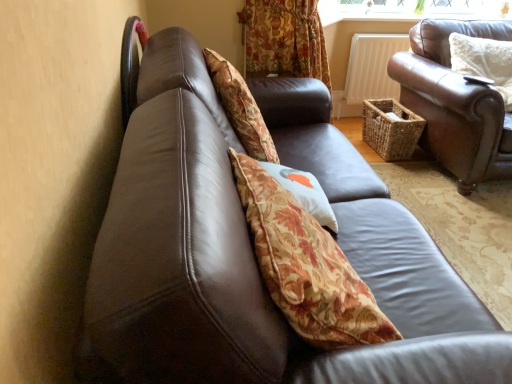
Where is `white fluffy pillow at upper right, which is the 2th pillow from bottom to top`? This screenshot has height=384, width=512. white fluffy pillow at upper right, which is the 2th pillow from bottom to top is located at coordinates (484, 62).

The image size is (512, 384). Find the location of `shiny black chair at upper left`. shiny black chair at upper left is located at coordinates (130, 66).

You are a GUI agent. You are given a task and a screenshot of the screen. Output one action in this format:
    pyautogui.click(x=<x>, y=<y>)
    Task: Click on the floral fabric cushion at center, the 2th pillow when ordered from right to left
    
    Given the screenshot: What is the action you would take?
    298,189

Which of these two, shiny black chair at upper left or brown leather couch at right, is smaller?

shiny black chair at upper left.

Consider the image. Is shiny black chair at upper left beside brown leather couch at right?

shiny black chair at upper left is not next to brown leather couch at right, and they're not touching.

From a real-world perspective, relative to brown leather couch at right, is shiny black chair at upper left vertically above or below?

shiny black chair at upper left is situated higher than brown leather couch at right in the real world.

Does white fluffy pillow at upper right, which is the second pillow from left to right, come in front of brown leather couch at right?

No, white fluffy pillow at upper right, which is the second pillow from left to right, is behind brown leather couch at right.

In the scene shown: From the image's perspective, is white fluffy pillow at upper right, which is the first pillow from right to left, over brown leather couch at right?

Yes, from the image's perspective, white fluffy pillow at upper right, which is the first pillow from right to left, is over brown leather couch at right.

Which is more to the left, white fluffy pillow at upper right, the 1th pillow viewed from the top, or brown leather couch at right?

white fluffy pillow at upper right, the 1th pillow viewed from the top, is more to the left.

Is white fluffy pillow at upper right, the 1th pillow viewed from the top, positioned far away from brown leather couch at right?

They are positioned close to each other.

From the image's perspective, which is below, brown leather couch at right or floral fabric cushion at center, the 1th pillow ordered from the bottom?

floral fabric cushion at center, the 1th pillow ordered from the bottom, appears lower in the image.

From a real-world perspective, which object rests below the other?

brown leather couch at right, from a real-world perspective.

Which of these two, brown leather couch at right or floral fabric cushion at center, the 2th pillow when ordered from right to left, is bigger?

brown leather couch at right is bigger.

Are brown leather couch at right and shiny black chair at upper left located far from each other?

Absolutely, brown leather couch at right is distant from shiny black chair at upper left.

Does brown leather couch at right have a greater width compared to shiny black chair at upper left?

Correct, the width of brown leather couch at right exceeds that of shiny black chair at upper left.

Which object is more forward, brown leather couch at right or shiny black chair at upper left?

shiny black chair at upper left is closer to the camera.

The width and height of the screenshot is (512, 384). In the image, there is a shiny black chair at upper left. In order to click on studio couch below it (from the image's perspective) in this screenshot , I will do `click(455, 103)`.

How different are the orientations of floral fabric cushion at center, which is the 2th pillow in top-to-bottom order, and white fluffy pillow at upper right, placed as the 2th pillow when sorted from front to back, in degrees?

They differ by 94.4 degrees in their facing directions.

Can you confirm if floral fabric cushion at center, the 2th pillow when ordered from right to left, is thinner than white fluffy pillow at upper right, which is the first pillow from right to left?

Yes.

Is floral fabric cushion at center, the 1th pillow ordered from the bottom, facing away from white fluffy pillow at upper right, placed as the 2th pillow when sorted from front to back?

Answer: floral fabric cushion at center, the 1th pillow ordered from the bottom, is not turned away from white fluffy pillow at upper right, placed as the 2th pillow when sorted from front to back.

Would you say floral fabric cushion at center, which appears as the second pillow when viewed from the back, contains white fluffy pillow at upper right, placed as the 2th pillow when sorted from front to back?

No, white fluffy pillow at upper right, placed as the 2th pillow when sorted from front to back, is not inside floral fabric cushion at center, which appears as the second pillow when viewed from the back.

From the image's perspective, is white fluffy pillow at upper right, which is the 2th pillow from bottom to top, located above shiny black chair at upper left?

Yes, from the image's perspective, white fluffy pillow at upper right, which is the 2th pillow from bottom to top, is over shiny black chair at upper left.

Is white fluffy pillow at upper right, the 1th pillow viewed from the top, next to shiny black chair at upper left and touching it?

No, white fluffy pillow at upper right, the 1th pillow viewed from the top, is not beside shiny black chair at upper left.

From a real-world perspective, which is physically below, white fluffy pillow at upper right, positioned as the 1th pillow in back-to-front order, or shiny black chair at upper left?

white fluffy pillow at upper right, positioned as the 1th pillow in back-to-front order, from a real-world perspective.

Can you tell me how much white fluffy pillow at upper right, placed as the 2th pillow when sorted from front to back, and shiny black chair at upper left differ in facing direction?

93.5 degrees separate the facing orientations of white fluffy pillow at upper right, placed as the 2th pillow when sorted from front to back, and shiny black chair at upper left.

Looking at this image, based on their positions, is shiny black chair at upper left located to the left or right of white fluffy pillow at upper right, which is the first pillow from right to left?

shiny black chair at upper left is positioned on white fluffy pillow at upper right, which is the first pillow from right to left,'s left side.

Would you say shiny black chair at upper left is a long distance from white fluffy pillow at upper right, which is the 2th pillow from bottom to top?

That's right, there is a large distance between shiny black chair at upper left and white fluffy pillow at upper right, which is the 2th pillow from bottom to top.

Could you tell me if shiny black chair at upper left is facing white fluffy pillow at upper right, placed as the 2th pillow when sorted from front to back?

Yes, shiny black chair at upper left faces towards white fluffy pillow at upper right, placed as the 2th pillow when sorted from front to back.

The height and width of the screenshot is (384, 512). In order to click on chair located on the left of brown leather couch at right in this screenshot , I will do `click(130, 66)`.

You are a GUI agent. You are given a task and a screenshot of the screen. Output one action in this format:
    pyautogui.click(x=<x>, y=<y>)
    Task: Click on the studio couch in front of the white fluffy pillow at upper right, which is the 2th pillow from bottom to top
    The image size is (512, 384).
    Given the screenshot: What is the action you would take?
    pyautogui.click(x=455, y=103)

Based on their spatial positions, is shiny black chair at upper left or brown leather couch at right further from floral fabric cushion at center, the 2th pillow when ordered from right to left?

brown leather couch at right lies further to floral fabric cushion at center, the 2th pillow when ordered from right to left, than the other object.

Estimate the real-world distances between objects in this image. Which object is closer to brown leather couch at right, white fluffy pillow at upper right, placed as the 2th pillow when sorted from front to back, or shiny black chair at upper left?

Based on the image, white fluffy pillow at upper right, placed as the 2th pillow when sorted from front to back, appears to be nearer to brown leather couch at right.

Which object lies nearer to the anchor point floral fabric cushion at center, which is the 2th pillow in top-to-bottom order, brown leather couch at right or shiny black chair at upper left?

shiny black chair at upper left lies closer to floral fabric cushion at center, which is the 2th pillow in top-to-bottom order, than the other object.

From the image, which object appears to be farther from shiny black chair at upper left, floral fabric cushion at center, which appears as the second pillow when viewed from the back, or white fluffy pillow at upper right, which is the first pillow from right to left?

The object further to shiny black chair at upper left is white fluffy pillow at upper right, which is the first pillow from right to left.

Which object lies nearer to the anchor point brown leather couch at right, shiny black chair at upper left or floral fabric cushion at center, which appears as the second pillow when viewed from the back?

Among the two, floral fabric cushion at center, which appears as the second pillow when viewed from the back, is located nearer to brown leather couch at right.

Which object lies further to the anchor point white fluffy pillow at upper right, the 1th pillow viewed from the top, floral fabric cushion at center, which appears as the second pillow when viewed from the back, or brown leather couch at right?

Based on the image, floral fabric cushion at center, which appears as the second pillow when viewed from the back, appears to be further to white fluffy pillow at upper right, the 1th pillow viewed from the top.

Estimate the real-world distances between objects in this image. Which object is further from white fluffy pillow at upper right, which is the 2th pillow from bottom to top, brown leather couch at right or shiny black chair at upper left?

shiny black chair at upper left.

From the image, which object appears to be farther from shiny black chair at upper left, brown leather couch at right or floral fabric cushion at center, which appears as the second pillow when viewed from the back?

The object further to shiny black chair at upper left is brown leather couch at right.

Where is `pillow between floral fabric cushion at center, which is the 2th pillow in top-to-bottom order, and brown leather couch at right from left to right`? The image size is (512, 384). pillow between floral fabric cushion at center, which is the 2th pillow in top-to-bottom order, and brown leather couch at right from left to right is located at coordinates (484, 62).

Image resolution: width=512 pixels, height=384 pixels. I want to click on pillow located between shiny black chair at upper left and white fluffy pillow at upper right, positioned as the 1th pillow in back-to-front order, in the left-right direction, so click(x=298, y=189).